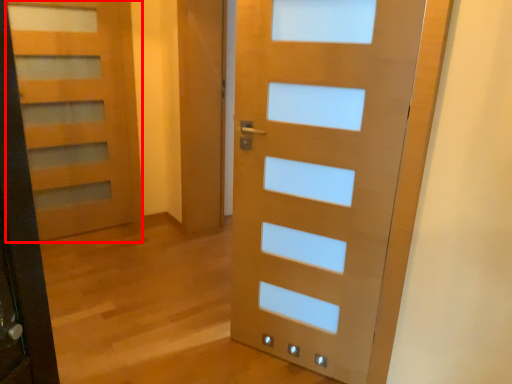
Question: From the image's perspective, what is the correct spatial relationship of door (annotated by the red box) in relation to door?

Choices:
 (A) below
 (B) above

Answer: (B)